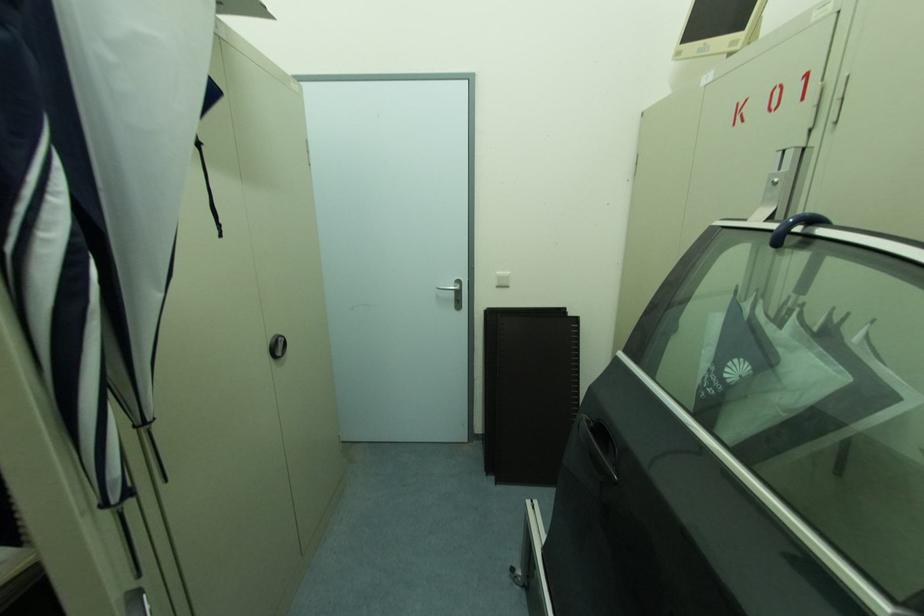
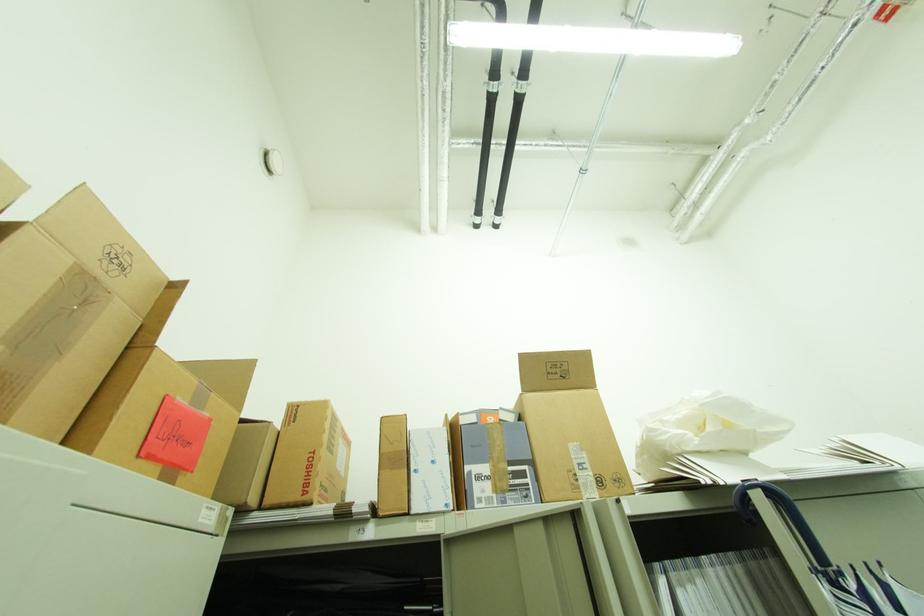
The images are taken continuously from a first-person perspective. In which direction is your viewpoint rotating?

The rotation direction of the camera is left-up.